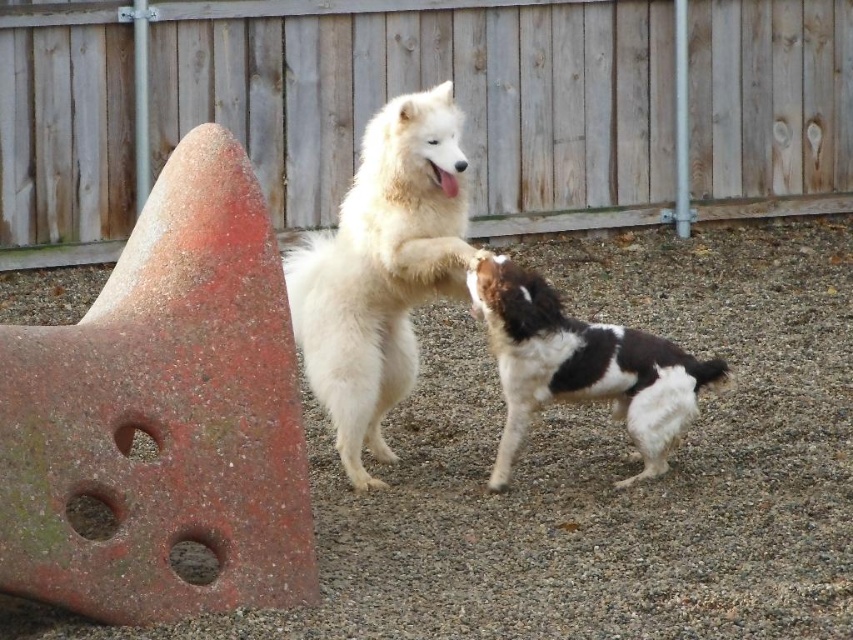
You are a dog owner who wants to ensure your white fluffy dog at center stays within the backyard. The wooden fence at upper center is the only barrier. Can the dog reach the fence without crossing the gravel area?

The distance between the wooden fence at upper center and the white fluffy dog at center is 9.75 feet. Since the gravel area is the only path between them, the dog would have to cross it to reach the fence.

You are a photographer trying to capture a photo of the wooden fence at upper center and the white fluffy dog at center. From the doggy perspective, which object is located to the right side?

The wooden fence at upper center is to the right of the white fluffy dog at center, so from the doggy perspective, the wooden fence at upper center is located to the right side.